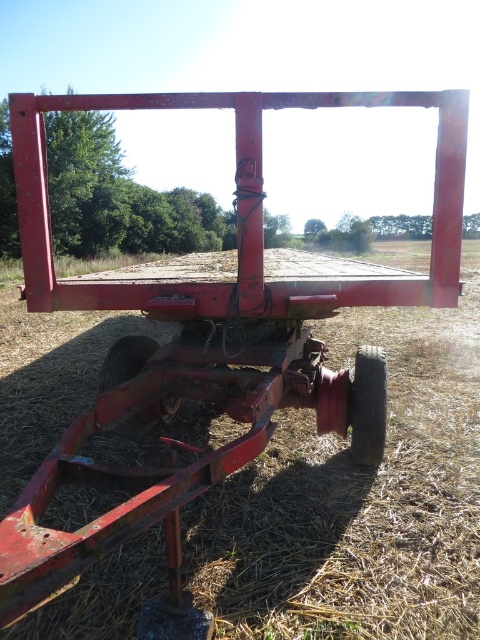
Question: Which point is closer to the camera?

Choices:
 (A) (367, 412)
 (B) (135, 369)

Answer: (A)

Question: Is rubber/rough wheel at lower right thinner than rubber/rough wheel at lower left?

Choices:
 (A) no
 (B) yes

Answer: (B)

Question: Which of the following is the farthest from the observer?

Choices:
 (A) rubber/rough wheel at lower right
 (B) rubber/rough wheel at lower left

Answer: (A)

Question: Where is rubber/rough wheel at lower right located in relation to rubber/rough wheel at lower left in the image?

Choices:
 (A) right
 (B) left

Answer: (A)

Question: Among these points, which one is nearest to the camera?

Choices:
 (A) (143, 348)
 (B) (368, 372)

Answer: (B)

Question: Can you confirm if rubber/rough wheel at lower right is bigger than rubber/rough wheel at lower left?

Choices:
 (A) no
 (B) yes

Answer: (A)